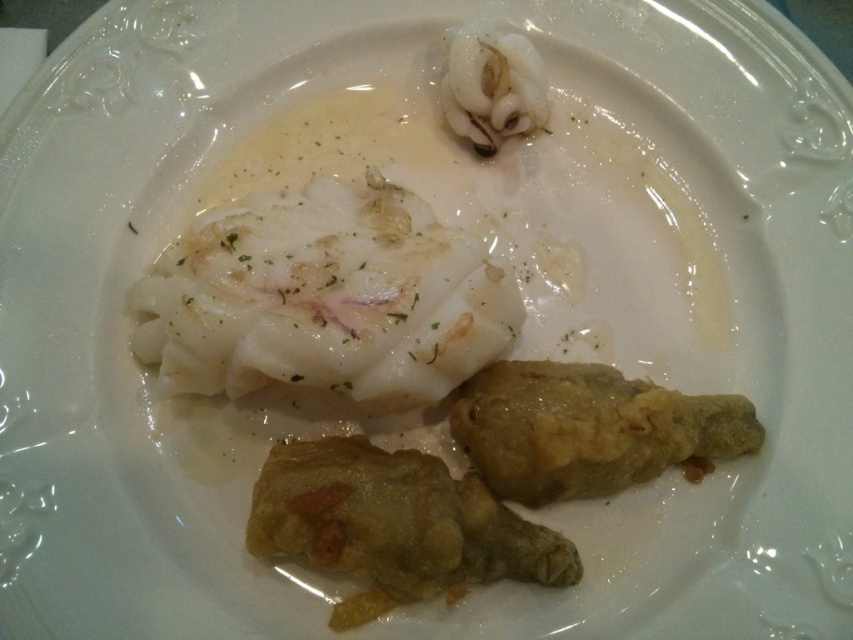
Which is behind, point (164, 356) or point (334, 490)?

Positioned behind is point (164, 356).

Where is `white creamy fish at center`? This screenshot has width=853, height=640. white creamy fish at center is located at coordinates (325, 298).

Where is `white creamy fish at center`? The image size is (853, 640). white creamy fish at center is located at coordinates (325, 298).

Looking at this image, which is below, white creamy fish at center or golden crispy fried chicken leg at lower right?

golden crispy fried chicken leg at lower right

Which is above, white creamy fish at center or golden crispy fried chicken leg at lower right?

white creamy fish at center is higher up.

The image size is (853, 640). Identify the location of white creamy fish at center. [x=325, y=298].

Identify the location of white creamy fish at center. The width and height of the screenshot is (853, 640). (325, 298).

This screenshot has width=853, height=640. What do you see at coordinates (393, 525) in the screenshot?
I see `golden crispy chicken leg at center` at bounding box center [393, 525].

Is golden crispy chicken leg at center below white glossy squid at upper center?

Yes, golden crispy chicken leg at center is below white glossy squid at upper center.

Locate an element on the screen. This screenshot has height=640, width=853. golden crispy chicken leg at center is located at coordinates (393, 525).

Locate an element on the screen. golden crispy chicken leg at center is located at coordinates (393, 525).